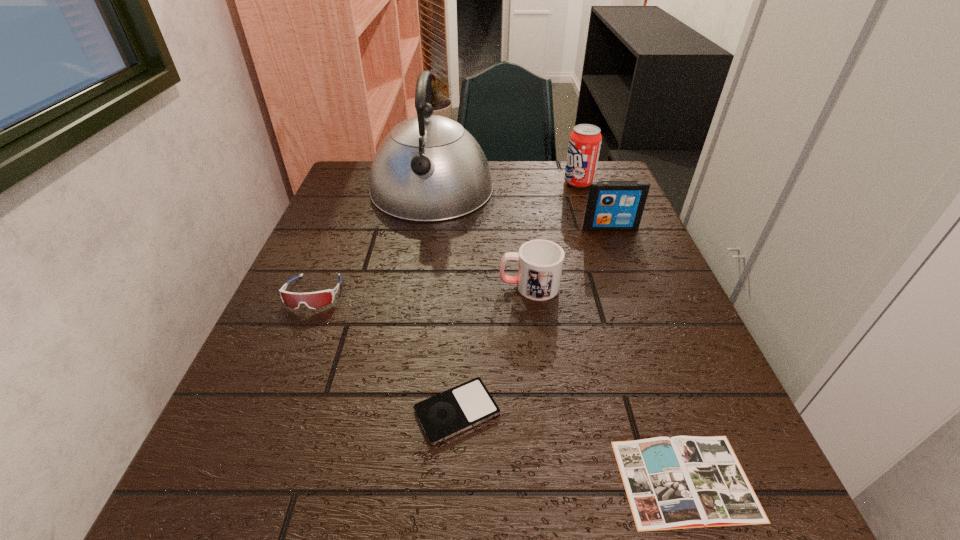
You are a GUI agent. You are given a task and a screenshot of the screen. Output one action in this format:
    pyautogui.click(x=<x>, y=<y>)
    Task: Click on the free space between the left iPod and the kettle
    This screenshot has height=540, width=960.
    Given the screenshot: What is the action you would take?
    pyautogui.click(x=444, y=301)

This screenshot has height=540, width=960. I want to click on empty location between the book and the farther iPod, so click(x=648, y=354).

Find the location of a particular element. This screenshot has height=540, width=960. empty space between the farther iPod and the tallest object is located at coordinates (521, 209).

Find the location of a particular element. The image size is (960, 540). empty location between the sixth shortest object and the tallest object is located at coordinates (505, 186).

Where is `vacant region between the kettle and the book`? Image resolution: width=960 pixels, height=540 pixels. vacant region between the kettle and the book is located at coordinates (559, 335).

You are a GUI agent. You are given a task and a screenshot of the screen. Output one action in this format:
    pyautogui.click(x=<x>, y=<y>)
    Task: Click on the object that is the third closest to the goggles
    The width and height of the screenshot is (960, 540).
    Given the screenshot: What is the action you would take?
    pyautogui.click(x=540, y=262)

Locate an element on the screen. This screenshot has height=540, width=960. object that is the fifth closest to the sixth shortest object is located at coordinates (442, 416).

At what (x,y) coordinates should I click in order to perform the action: click on vacant space that satisfies the following two spatial constraints: 1. on the back side of the book; 2. on the side of the fourth object from right to left with the handle. Please return your answer as a coordinate pair (x, y). Image resolution: width=960 pixels, height=540 pixels. Looking at the image, I should click on tap(617, 286).

Locate an element on the screen. free space that satisfies the following two spatial constraints: 1. on the surface of the sixth shortest object; 2. from the spout of the kettle is located at coordinates (581, 190).

Locate an element on the screen. vacant space that satisfies the following two spatial constraints: 1. on the side of the mug with the handle; 2. on the right side of the book is located at coordinates (554, 480).